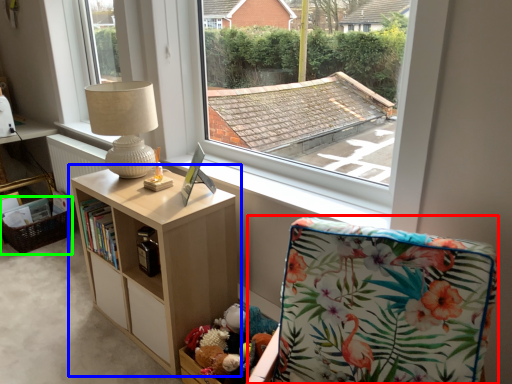
Question: Based on their relative distances, which object is farther from rocking chair (highlighted by a red box)? Choose from shelf (highlighted by a blue box) and basket (highlighted by a green box).

Choices:
 (A) shelf
 (B) basket

Answer: (B)